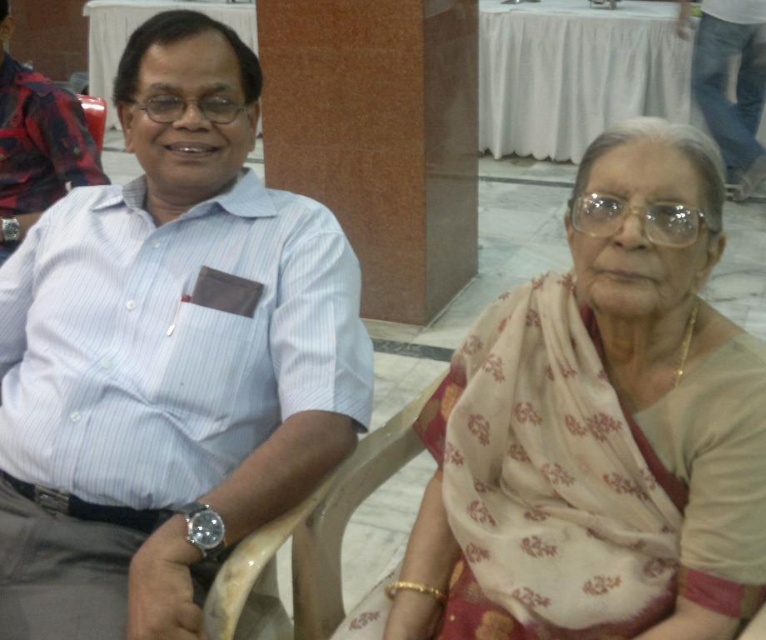
You are standing in the room and want to place a new decorative item exactly at the position where the beige floral saree at center is located. What are the coordinates of that location?

The beige floral saree at center is located at coordinates point (x=604, y=424).

You are standing in front of the image and want to know how far the point at coordinates (322,508) is from your current position. Can you determine the distance?

The point at coordinates (322,508) is 4.47 feet from the camera, so it is approximately 4.47 feet away from your current position.